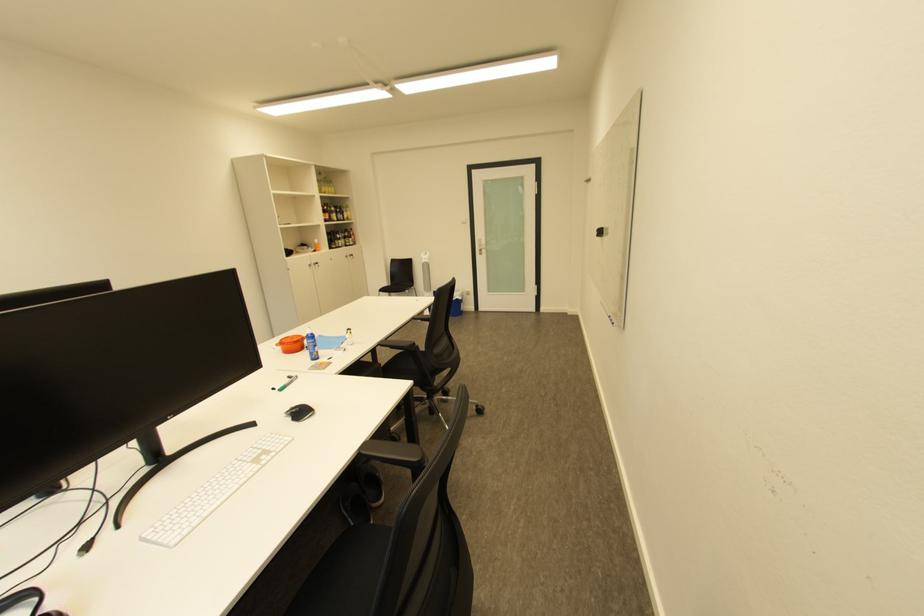
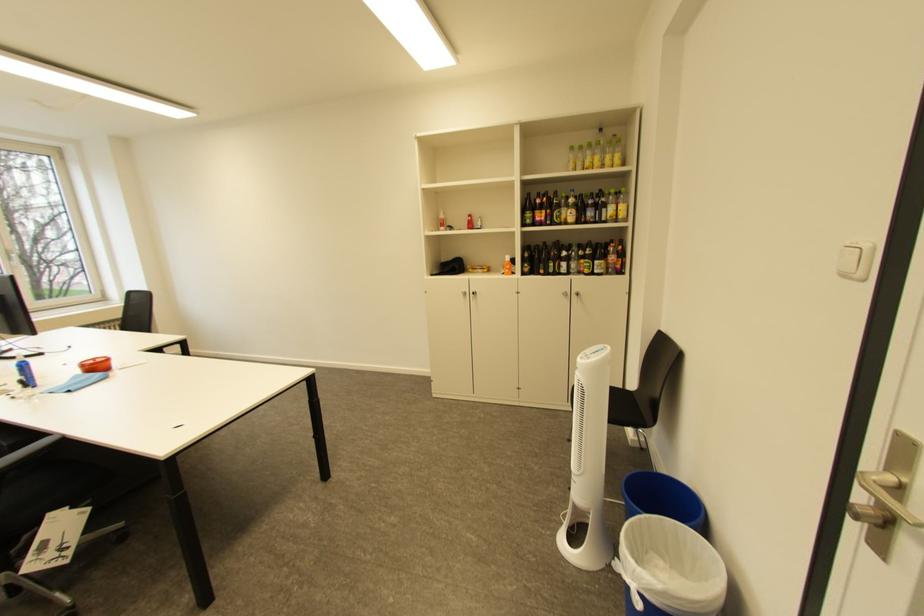
The point at (x=346, y=243) is marked in the first image. Where is the corresponding point in the second image?

(562, 265)